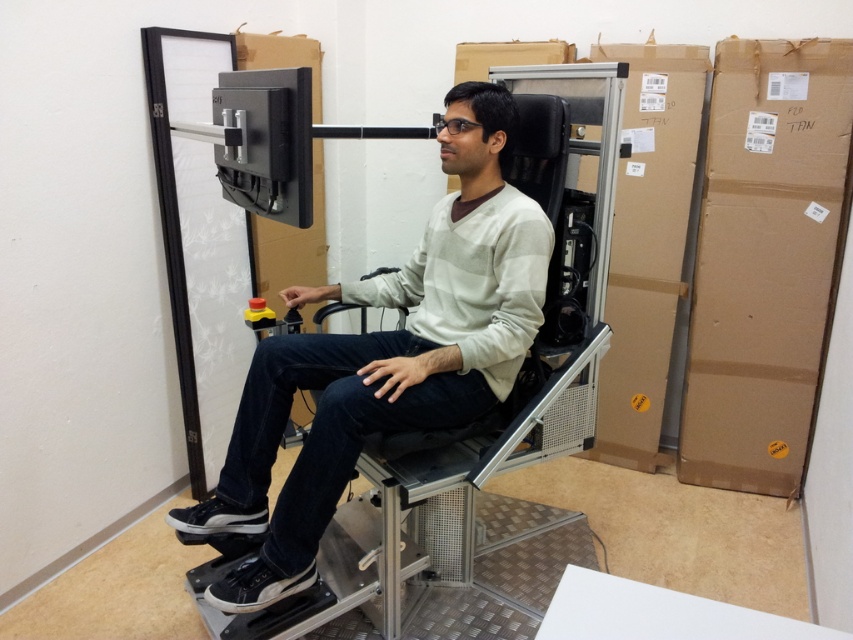
Question: Is matte gray chair at center further to the viewer compared to brown cardboard box at right?

Choices:
 (A) no
 (B) yes

Answer: (A)

Question: Is matte gray chair at center wider than brown cardboard box at right?

Choices:
 (A) yes
 (B) no

Answer: (A)

Question: Can you confirm if matte gray chair at center is positioned above brown cardboard box at right?

Choices:
 (A) yes
 (B) no

Answer: (B)

Question: Which point is closer to the camera?

Choices:
 (A) matte gray chair at center
 (B) brown cardboard box at right

Answer: (A)

Question: Which point is farther to the camera?

Choices:
 (A) (379, 394)
 (B) (831, 108)

Answer: (B)